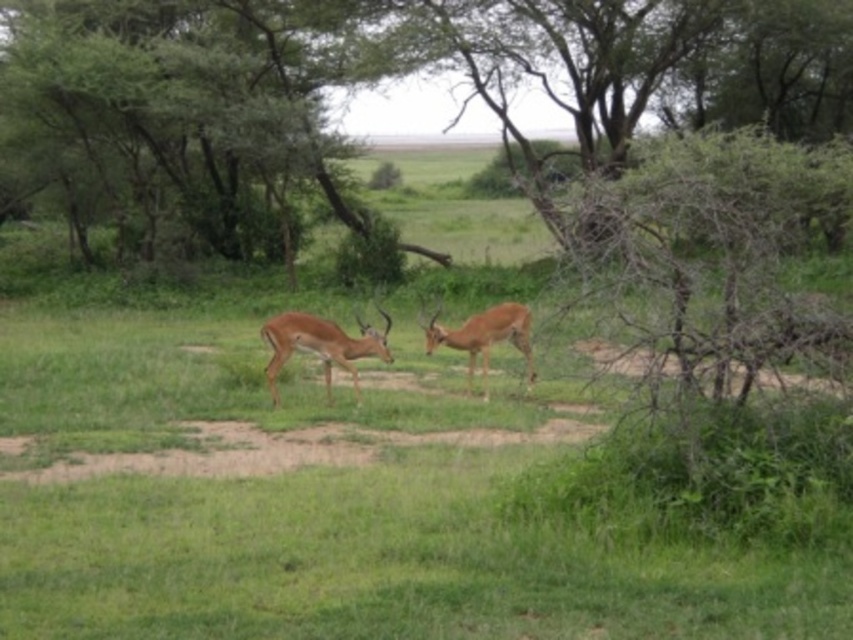
Can you confirm if green leafy tree at center is smaller than brown matte deer at center?

Actually, green leafy tree at center might be larger than brown matte deer at center.

Which is behind, point (500, 24) or point (287, 321)?

The point (500, 24) is behind.

Between point (78, 74) and point (294, 326), which one is positioned in front?

Positioned in front is point (294, 326).

At what (x,y) coordinates should I click in order to perform the action: click on green leafy tree at center. Please return your answer as a coordinate pair (x, y). The height and width of the screenshot is (640, 853). Looking at the image, I should click on (367, 84).

Consider the image. Can you confirm if green leafy tree at center is wider than brown matte antelope at center?

Yes, green leafy tree at center is wider than brown matte antelope at center.

Who is shorter, green leafy tree at center or brown matte antelope at center?

Standing shorter between the two is brown matte antelope at center.

Locate an element on the screen. green leafy tree at center is located at coordinates (367, 84).

Identify the location of green leafy tree at center. Image resolution: width=853 pixels, height=640 pixels. (367, 84).

Is brown matte deer at center to the right of brown matte antelope at center from the viewer's perspective?

Incorrect, brown matte deer at center is not on the right side of brown matte antelope at center.

Identify the location of brown matte deer at center. Image resolution: width=853 pixels, height=640 pixels. (321, 346).